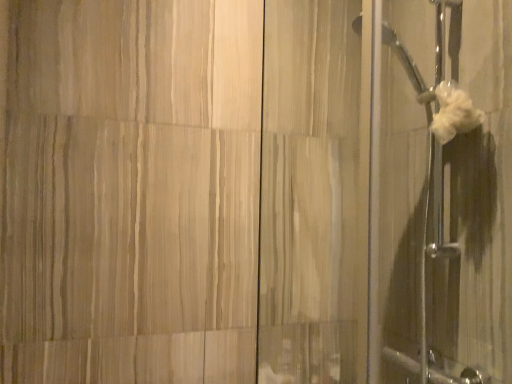
Question: Which is correct: white fabric at right is inside white fluffy towel at upper right, or outside of it?

Choices:
 (A) inside
 (B) outside

Answer: (B)

Question: From the image's perspective, relative to white fluffy towel at upper right, is white fabric at right above or below?

Choices:
 (A) above
 (B) below

Answer: (B)

Question: Is white fabric at right in front of or behind white fluffy towel at upper right in the image?

Choices:
 (A) front
 (B) behind

Answer: (A)

Question: Is point (437, 122) positioned closer to the camera than point (460, 64)?

Choices:
 (A) closer
 (B) farther

Answer: (A)

Question: Considering the positions of white fluffy towel at upper right and white fabric at right in the image, is white fluffy towel at upper right wider or thinner than white fabric at right?

Choices:
 (A) wide
 (B) thin

Answer: (B)

Question: Is white fluffy towel at upper right spatially inside white fabric at right, or outside of it?

Choices:
 (A) outside
 (B) inside

Answer: (B)

Question: In the image, is white fluffy towel at upper right positioned in front of or behind white fabric at right?

Choices:
 (A) behind
 (B) front

Answer: (A)